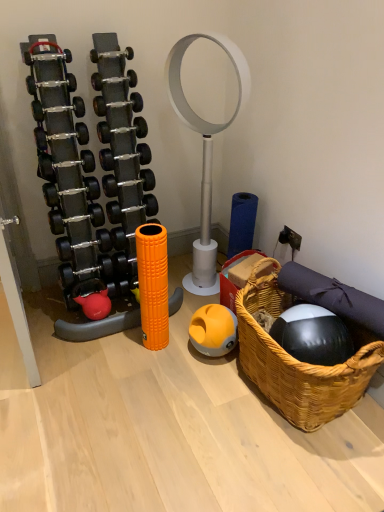
Find the location of `vacant space that is to the left of orange rubber ball at center`. vacant space that is to the left of orange rubber ball at center is located at coordinates (178, 354).